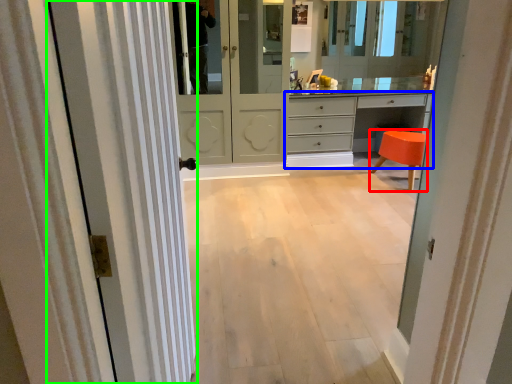
Question: Estimate the real-world distances between objects in this image. Which object is closer to stool (highlighted by a red box), chest of drawers (highlighted by a blue box) or door (highlighted by a green box)?

Choices:
 (A) chest of drawers
 (B) door

Answer: (A)